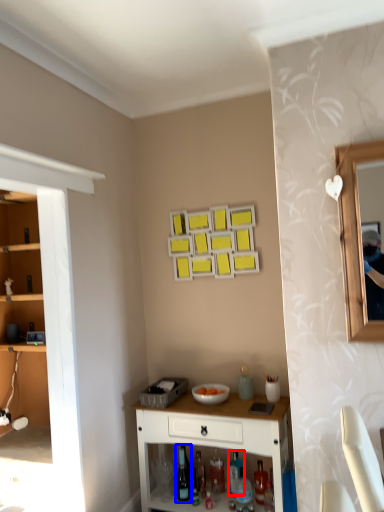
Question: Which object is further to the camera taking this photo, bottle (highlighted by a red box) or wine bottle (highlighted by a blue box)?

Choices:
 (A) bottle
 (B) wine bottle

Answer: (A)